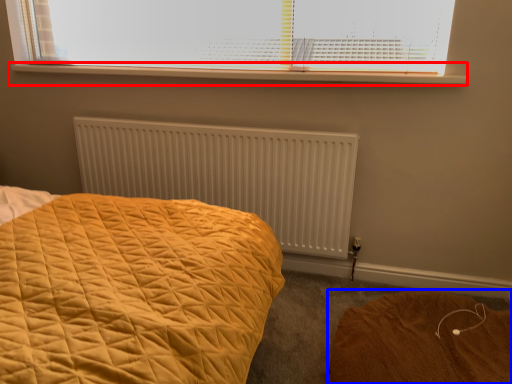
Question: Which object appears farthest to the camera in this image, window sill (highlighted by a red box) or plain (highlighted by a blue box)?

Choices:
 (A) window sill
 (B) plain

Answer: (A)